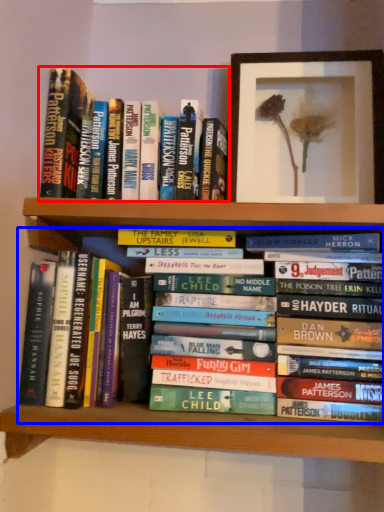
Question: Which object is further to the camera taking this photo, book (highlighted by a red box) or book (highlighted by a blue box)?

Choices:
 (A) book
 (B) book

Answer: (A)